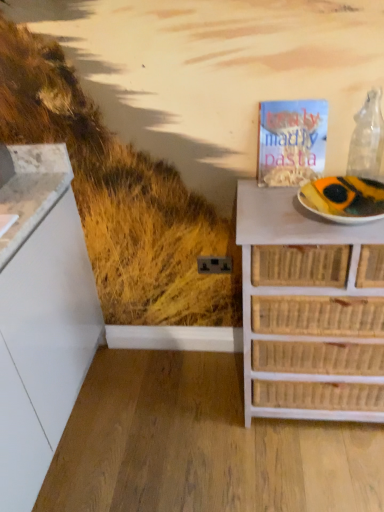
Locate an element on the screen. The width and height of the screenshot is (384, 512). vacant space positioned to the left of white paper plate at right is located at coordinates (268, 214).